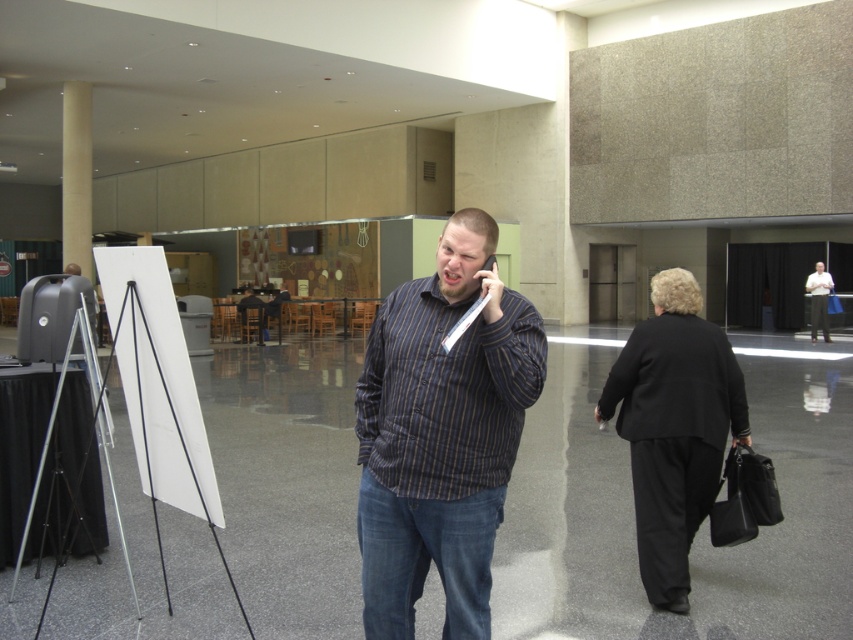
Does white matte tripod at left have a larger size compared to beige concrete pillar at left?

No.

Does white matte tripod at left appear on the left side of beige concrete pillar at left?

Incorrect, white matte tripod at left is not on the left side of beige concrete pillar at left.

At what (x,y) coordinates should I click in order to perform the action: click on white matte tripod at left. Please return your answer as a coordinate pair (x, y). The height and width of the screenshot is (640, 853). Looking at the image, I should click on (161, 422).

You are a GUI agent. You are given a task and a screenshot of the screen. Output one action in this format:
    pyautogui.click(x=<x>, y=<y>)
    Task: Click on the white matte tripod at left
    The image size is (853, 640).
    Given the screenshot: What is the action you would take?
    pyautogui.click(x=161, y=422)

Can you confirm if striped cotton shirt at center is wider than striped shirt at center?

Correct, the width of striped cotton shirt at center exceeds that of striped shirt at center.

Where is `striped cotton shirt at center`? striped cotton shirt at center is located at coordinates (440, 433).

Identify the location of striped cotton shirt at center. (440, 433).

Is point (820, 273) less distant than point (248, 310)?

Yes, it is in front of point (248, 310).

Who is lower down, white cotton shirt at center or dark blue striped shirt at center?

Positioned lower is dark blue striped shirt at center.

Who is more distant from viewer, (x=828, y=284) or (x=247, y=332)?

Point (x=247, y=332)

You are a GUI agent. You are given a task and a screenshot of the screen. Output one action in this format:
    pyautogui.click(x=<x>, y=<y>)
    Task: Click on the white cotton shirt at center
    
    Given the screenshot: What is the action you would take?
    pyautogui.click(x=817, y=300)